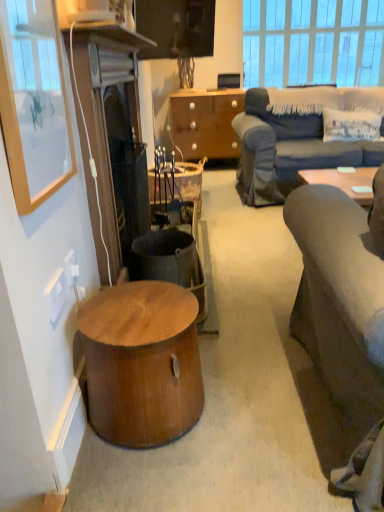
The image size is (384, 512). Identify the location of vacant space to the right of rustic wood desk at center. (226, 218).